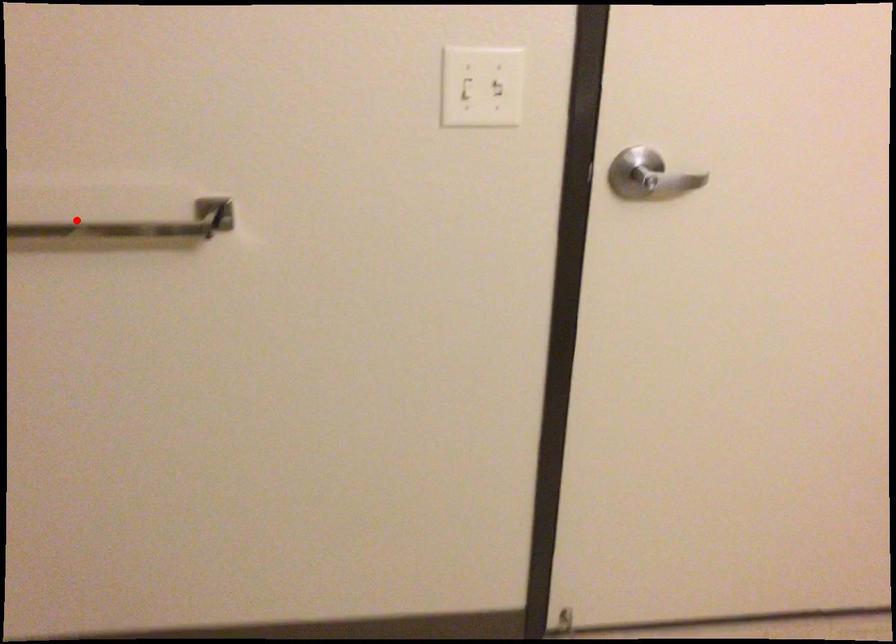
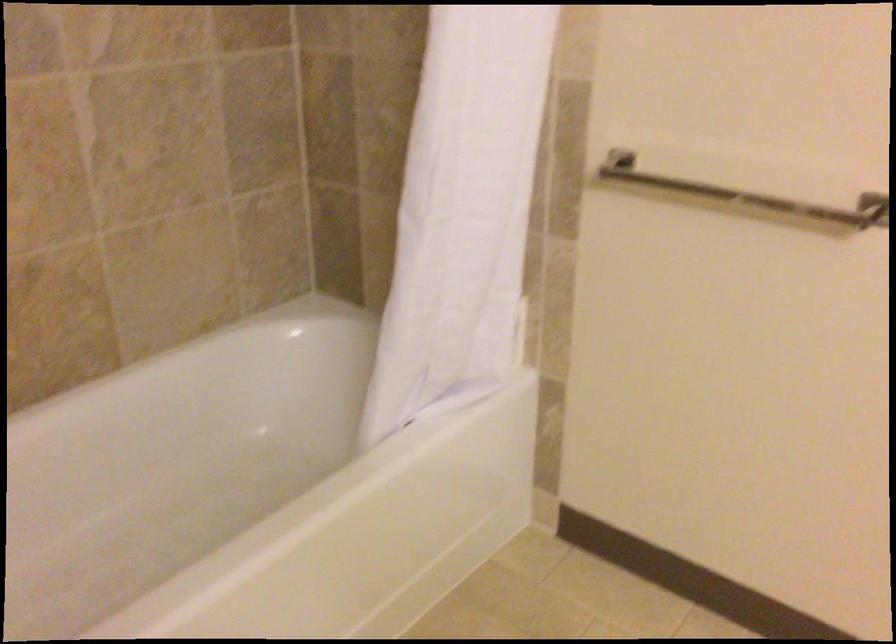
Question: A red point is marked in image1. In image2, is the corresponding 3D point closer to the camera or farther? Reply with the corresponding letter.

Choices:
 (A) The corresponding 3D point is closer.
 (B) The corresponding 3D point is farther.

Answer: (B)